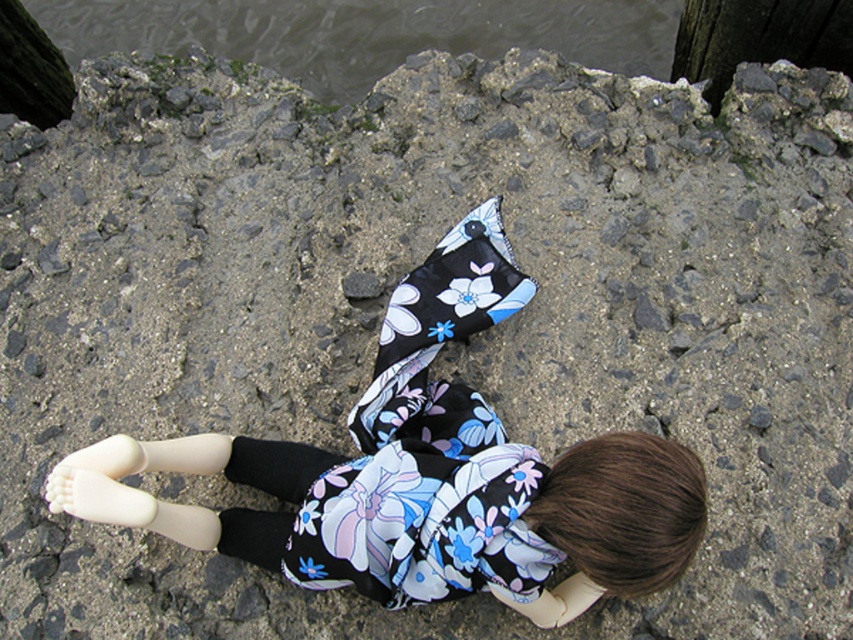
Consider the image. Who is shorter, floral fabric doll at center or clear water at upper center?

With less height is clear water at upper center.

Is floral fabric doll at center wider than clear water at upper center?

Incorrect, floral fabric doll at center's width does not surpass clear water at upper center's.

Is point (511, 531) behind point (328, 51)?

No, it is in front of (328, 51).

Image resolution: width=853 pixels, height=640 pixels. I want to click on floral fabric doll at center, so click(x=425, y=474).